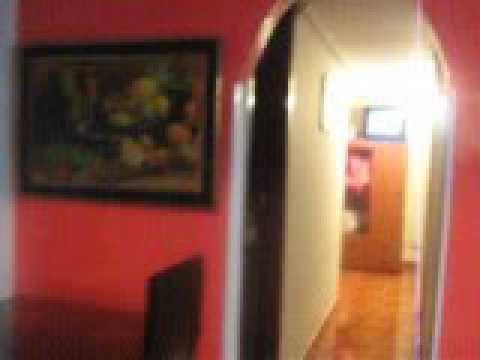
Where is `light`? This screenshot has height=360, width=480. light is located at coordinates (416, 105), (365, 101).